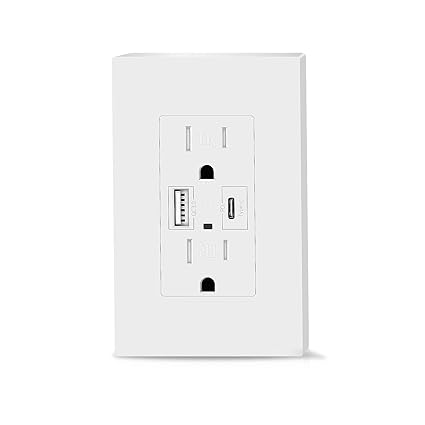
Where is `right corner`? This screenshot has height=425, width=425. right corner is located at coordinates (294, 59).